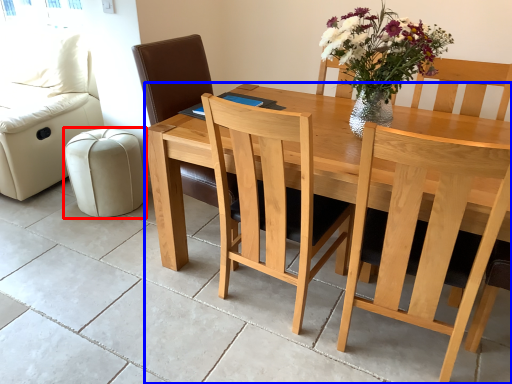
Question: Among these objects, which one is nearest to the camera, stool (highlighted by a red box) or table (highlighted by a blue box)?

Choices:
 (A) stool
 (B) table

Answer: (B)